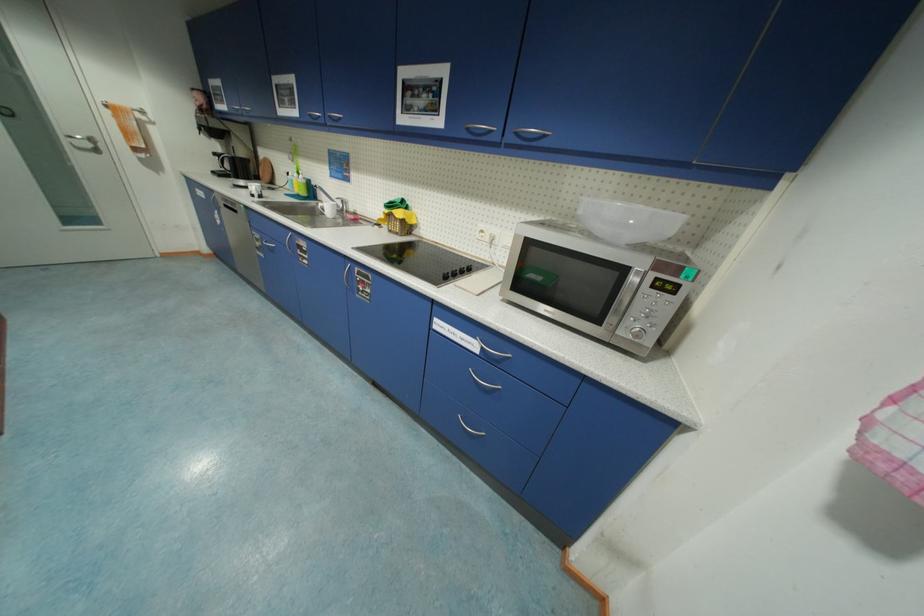
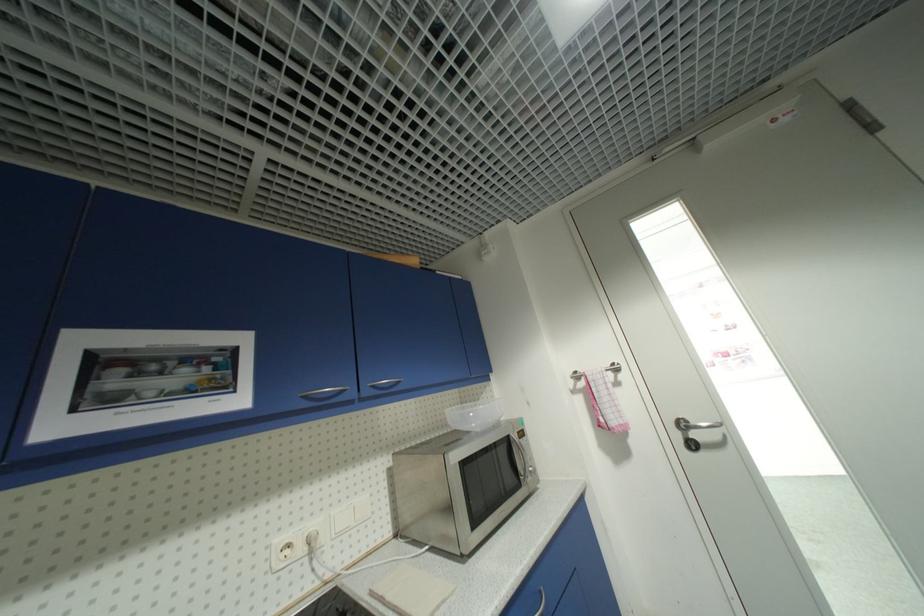
Locate, in the second image, the point that corresponds to (x=523, y=135) in the first image.

(379, 387)